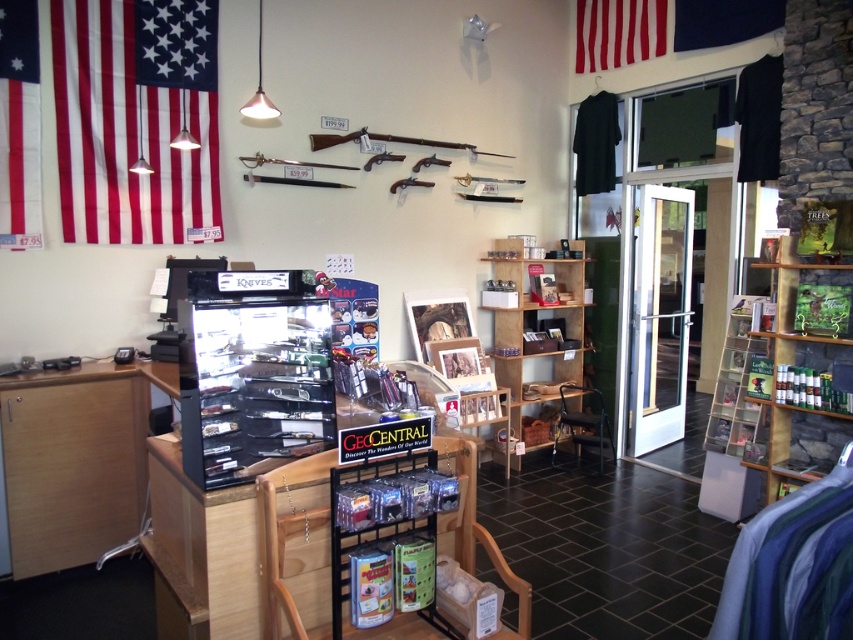
Is red/white striped flag at upper left thinner than wooden shelves at center?

Result: Yes, red/white striped flag at upper left is thinner than wooden shelves at center.

Can you confirm if red/white striped flag at upper left is positioned to the right of wooden shelves at center?

In fact, red/white striped flag at upper left is to the left of wooden shelves at center.

Where is `red/white striped flag at upper left`? The width and height of the screenshot is (853, 640). red/white striped flag at upper left is located at coordinates (135, 120).

Which is more to the right, red fabric flag at upper left or red fabric flag at upper center?

Positioned to the right is red fabric flag at upper center.

Which is more to the left, red fabric flag at upper left or red fabric flag at upper center?

red fabric flag at upper left

Is point (3, 60) closer to camera compared to point (616, 19)?

Yes, point (3, 60) is in front of point (616, 19).

Locate an element on the screen. The width and height of the screenshot is (853, 640). red fabric flag at upper left is located at coordinates (19, 125).

From the picture: Is red fabric flag at upper left above blue fabric flag at upper center?

No, red fabric flag at upper left is not above blue fabric flag at upper center.

Is red fabric flag at upper left smaller than blue fabric flag at upper center?

Correct, red fabric flag at upper left occupies less space than blue fabric flag at upper center.

Is point (6, 51) closer to camera compared to point (679, 38)?

Yes, point (6, 51) is closer to viewer.

The width and height of the screenshot is (853, 640). What are the coordinates of `red fabric flag at upper left` in the screenshot? It's located at (19, 125).